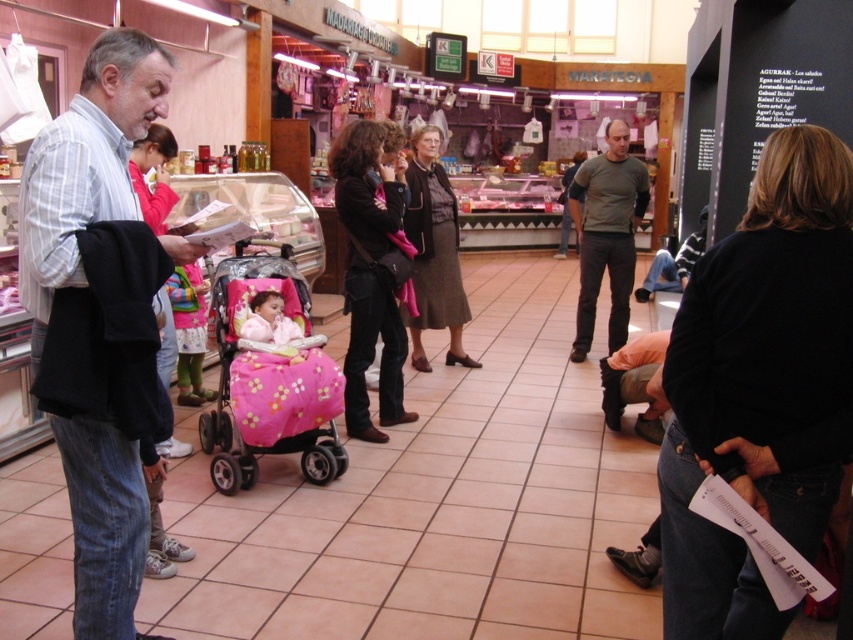
Looking at this image, who is positioned more to the left, black leather jacket at center or brown fabric skirt at center?

black leather jacket at center

In order to click on black leather jacket at center in this screenshot , I will do `click(370, 275)`.

You are a GUI agent. You are given a task and a screenshot of the screen. Output one action in this format:
    pyautogui.click(x=<x>, y=<y>)
    Task: Click on the black leather jacket at center
    The width and height of the screenshot is (853, 640).
    Given the screenshot: What is the action you would take?
    pyautogui.click(x=370, y=275)

Is point (306, 403) positioned behind point (372, 237)?

No, it is not.

Which is more to the left, pink fabric baby carriage at center or black leather jacket at center?

From the viewer's perspective, pink fabric baby carriage at center appears more on the left side.

This screenshot has width=853, height=640. I want to click on pink fabric baby carriage at center, so click(x=270, y=380).

From the picture: Does pink fabric baby carriage at center come in front of pink plush baby carriage at center?

Yes, it is in front of pink plush baby carriage at center.

Which is in front, point (279, 419) or point (283, 323)?

Point (279, 419) is in front.

At what (x,y) coordinates should I click in order to perform the action: click on pink fabric baby carriage at center. Please return your answer as a coordinate pair (x, y). Looking at the image, I should click on (270, 380).